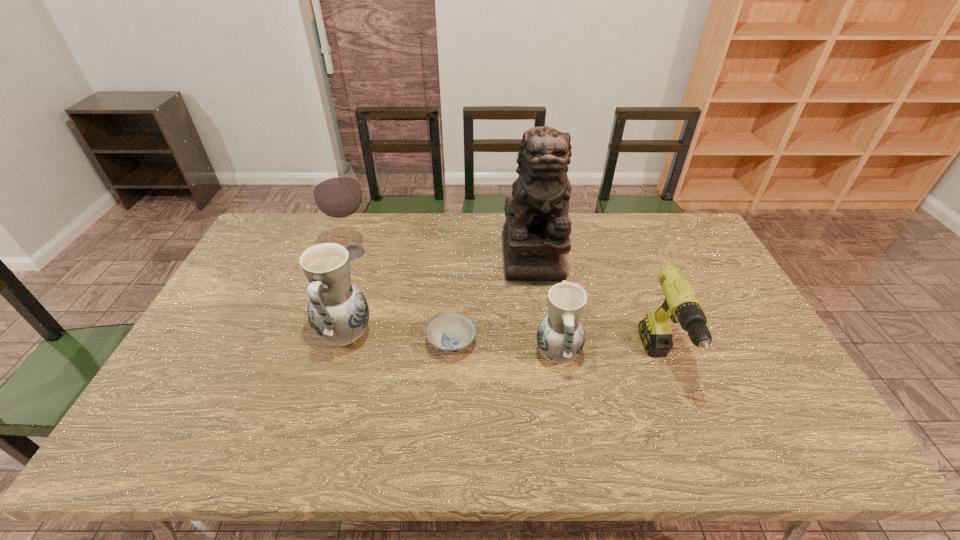
In the image, there is a desktop. Identify the location of vacant space at the right edge. (734, 362).

This screenshot has width=960, height=540. Identify the location of vacant position at the far right corner of the desktop. (x=685, y=245).

The image size is (960, 540). I want to click on vacant region at the near right corner of the desktop, so click(747, 411).

Identify the location of free space that is in between the right pottery and the alcohol. (455, 304).

At what (x,y) coordinates should I click in order to perform the action: click on vacant region between the drill and the sculpture. Please return your answer as a coordinate pair (x, y). The height and width of the screenshot is (540, 960). Looking at the image, I should click on (x=597, y=309).

Where is `free space between the alcohol and the fourth object from right to left`? Image resolution: width=960 pixels, height=540 pixels. free space between the alcohol and the fourth object from right to left is located at coordinates (402, 298).

Find the location of a particular element. free point between the third object from left to right and the taller pottery is located at coordinates (398, 339).

Where is `vacant space in between the right pottery and the shortest object`? vacant space in between the right pottery and the shortest object is located at coordinates (505, 349).

I want to click on object that is the nearest to the third object from left to right, so click(x=338, y=313).

Where is `object that is the third closest one to the left pottery`? This screenshot has width=960, height=540. object that is the third closest one to the left pottery is located at coordinates (536, 232).